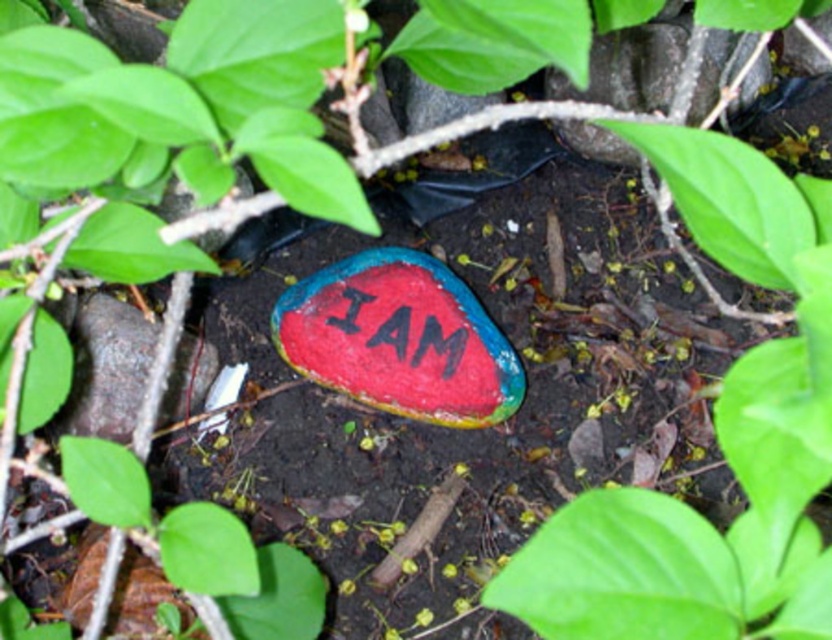
Question: Can you confirm if green matte rock at center is positioned above smooth painted rock at center?

Choices:
 (A) yes
 (B) no

Answer: (B)

Question: Among these points, which one is farthest from the camera?

Choices:
 (A) (124, 324)
 (B) (776, 394)

Answer: (A)

Question: Does green matte rock at center appear on the right side of smooth painted rock at center?

Choices:
 (A) no
 (B) yes

Answer: (A)

Question: Can you confirm if green matte rock at center is positioned below smooth painted rock at center?

Choices:
 (A) no
 (B) yes

Answer: (B)

Question: Among these objects, which one is nearest to the camera?

Choices:
 (A) green matte rock at center
 (B) smooth painted rock at center
 (C) painted rock at center

Answer: (A)

Question: Which object is closer to the camera taking this photo?

Choices:
 (A) smooth painted rock at center
 (B) painted rock at center
 (C) green matte rock at center

Answer: (C)